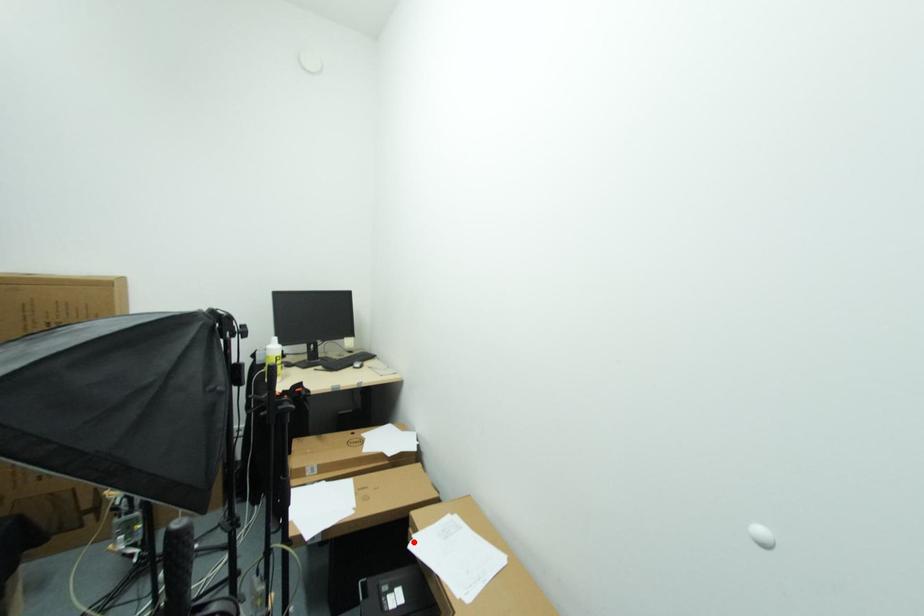
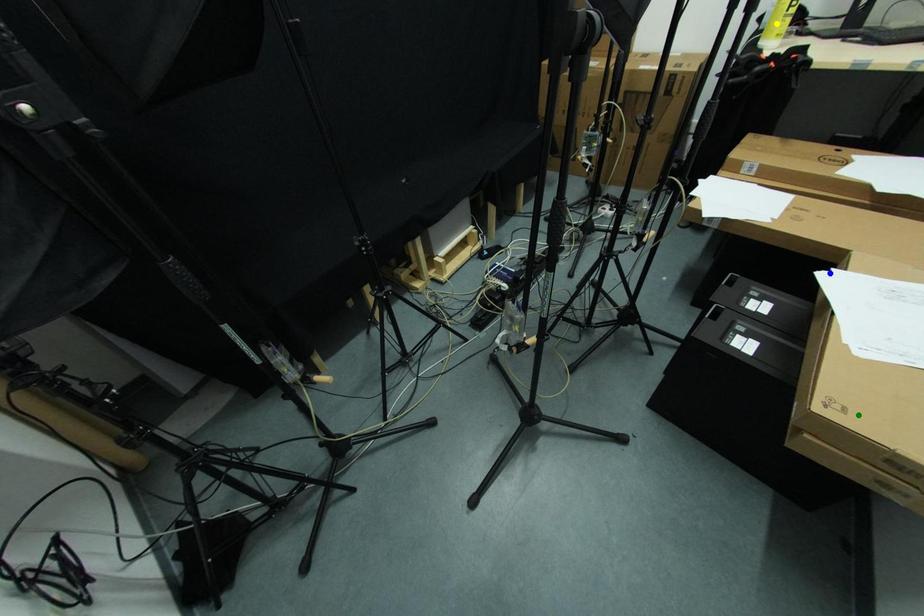
Question: I am providing you with two images of the same scene from different viewpoints. A red point is marked on the first image. You are given multiple points on the second image. In image 2, which mark is for the same physical point as the one in image 1?

Choices:
 (A) green point
 (B) blue point
 (C) yellow point

Answer: (B)